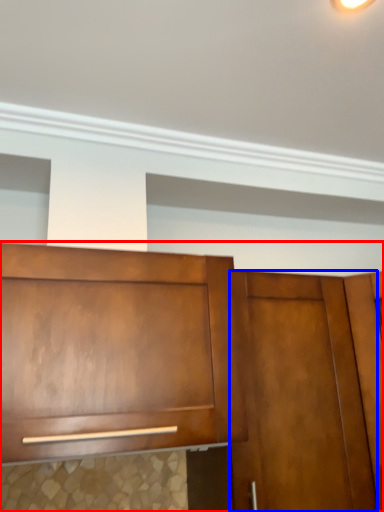
Question: Among these objects, which one is nearest to the camera, cabinetry (highlighted by a red box) or door (highlighted by a blue box)?

Choices:
 (A) cabinetry
 (B) door

Answer: (A)